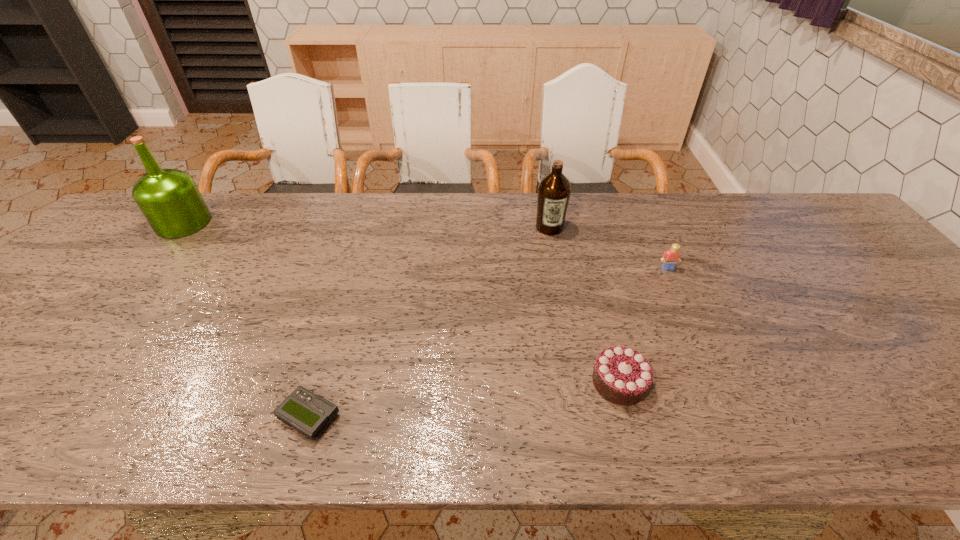
Find the location of a particular element. This screenshot has width=960, height=540. the tallest object is located at coordinates (169, 199).

At what (x,y) coordinates should I click in order to perform the action: click on the taller olive oil. Please return your answer as a coordinate pair (x, y). Image resolution: width=960 pixels, height=540 pixels. Looking at the image, I should click on (169, 199).

The width and height of the screenshot is (960, 540). Identify the location of the right olive oil. tap(554, 190).

Where is `the fourth shortest object`? The height and width of the screenshot is (540, 960). the fourth shortest object is located at coordinates (554, 190).

The height and width of the screenshot is (540, 960). Identify the location of the third farthest object. (670, 258).

This screenshot has width=960, height=540. What are the coordinates of `Lego` in the screenshot? It's located at (670, 258).

This screenshot has width=960, height=540. In order to click on chocolate cake in this screenshot , I will do `click(623, 376)`.

Where is `beeper`? This screenshot has height=540, width=960. beeper is located at coordinates (308, 413).

Locate an element on the screen. This screenshot has width=960, height=540. the second object from left to right is located at coordinates (308, 413).

You are a GUI agent. You are given a task and a screenshot of the screen. Output one action in this format:
    pyautogui.click(x=<x>, y=<y>)
    Task: Click on the vacant space located on the front of the leftmost object
    The height and width of the screenshot is (540, 960).
    Given the screenshot: What is the action you would take?
    pyautogui.click(x=104, y=323)